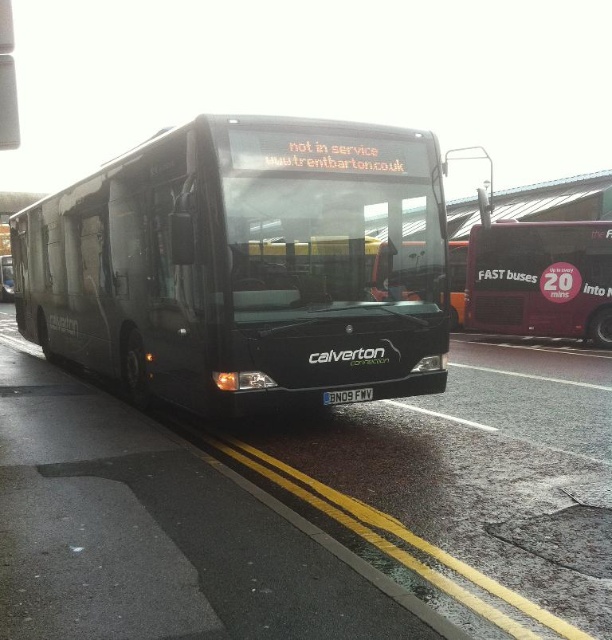
Question: Can you confirm if maroon metallic bus at right is thinner than black plastic license plate at center?

Choices:
 (A) yes
 (B) no

Answer: (B)

Question: Which object is the farthest from the matte black bus at center?

Choices:
 (A) black plastic license plate at center
 (B) maroon metallic bus at right

Answer: (B)

Question: Which point appears closest to the camera in this image?

Choices:
 (A) (356, 401)
 (B) (296, 266)
 (C) (506, 301)

Answer: (B)

Question: Is matte black bus at center smaller than maroon metallic bus at right?

Choices:
 (A) yes
 (B) no

Answer: (B)

Question: From the image, what is the correct spatial relationship of matte black bus at center in relation to maroon metallic bus at right?

Choices:
 (A) below
 (B) above

Answer: (A)

Question: Among these objects, which one is nearest to the camera?

Choices:
 (A) black plastic license plate at center
 (B) maroon metallic bus at right
 (C) matte black bus at center

Answer: (C)